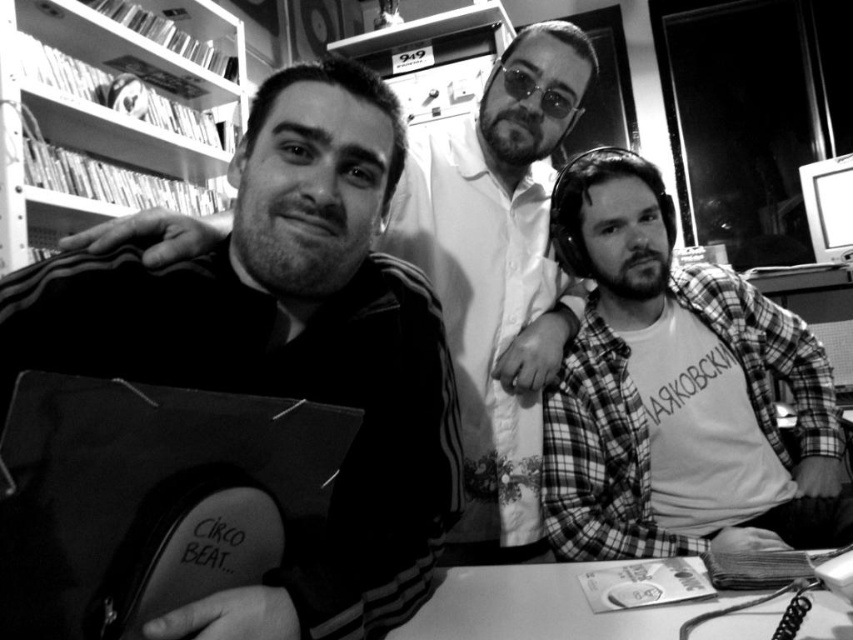
Question: Among these points, which one is farthest from the camera?

Choices:
 (A) (718, 390)
 (B) (488, 252)
 (C) (459, 580)

Answer: (B)

Question: Is smooth black jacket at left to the left of smooth white table at lower center from the viewer's perspective?

Choices:
 (A) yes
 (B) no

Answer: (A)

Question: Which object is farther from the camera taking this photo?

Choices:
 (A) smooth white table at lower center
 (B) metallic shelves at upper left
 (C) plaid shirt at right

Answer: (B)

Question: Which of the following is the closest to the observer?

Choices:
 (A) (624, 524)
 (B) (173, 145)

Answer: (A)

Question: Can you confirm if metallic shelves at upper left is positioned to the right of smooth white table at lower center?

Choices:
 (A) no
 (B) yes

Answer: (A)

Question: Is the position of smooth black jacket at left more distant than that of smooth white table at lower center?

Choices:
 (A) no
 (B) yes

Answer: (B)